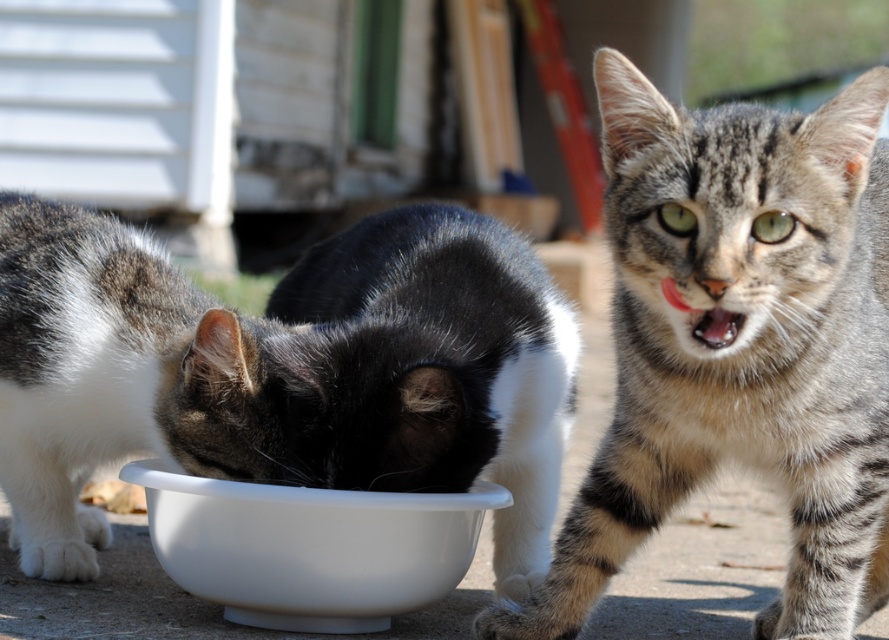
You are a photographer trying to capture a photo of the tabby fur cat at center and the white glossy bowl at center. Since you want to ensure both subjects are in focus, you need to know their relative sizes. Which one is taller?

The tabby fur cat at center is much taller than the white glossy bowl at center, so you should adjust your camera settings to accommodate the larger subject.

You are standing in the backyard and want to place a 1.5 meter long fence post between the two cats. The point where you need to place it is at point (501, 616). Is the distance from the camera to this point sufficient to fit the fence post without it being too close?

The point (501, 616) is 2.10 meters from the camera. Since the fence post is 1.5 meters long, the distance is sufficient as 2.10 meters is greater than 1.5 meters.

Consider the image. You are a cat owner who wants to place a new toy between the tabby fur cat at center and the white glossy bowl at center. Based on their positions, which side of the bowl should you place the toy to avoid disturbing the cats?

The tabby fur cat at center is positioned on the right side of the white glossy bowl at center, so placing the toy to the left side of the bowl would keep it away from the cat and avoid disturbing them.